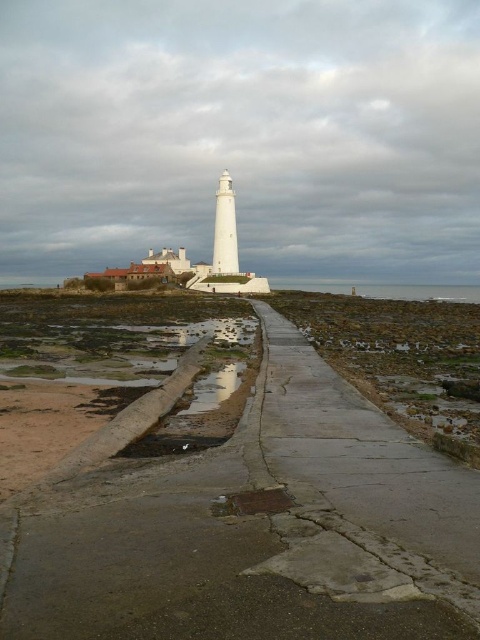
Question: Among these objects, which one is farthest from the camera?

Choices:
 (A) concrete sidewalk at center
 (B) concrete at center
 (C) glossy concrete puddle at lower center

Answer: (C)

Question: Can you confirm if concrete at center is positioned below concrete sidewalk at center?

Choices:
 (A) no
 (B) yes

Answer: (B)

Question: Which is nearer to the concrete at center?

Choices:
 (A) concrete sidewalk at center
 (B) glossy concrete puddle at lower center

Answer: (A)

Question: Where is concrete sidewalk at center located in relation to glossy concrete puddle at lower center in the image?

Choices:
 (A) right
 (B) left

Answer: (A)

Question: Can you confirm if concrete sidewalk at center is thinner than glossy concrete puddle at lower center?

Choices:
 (A) no
 (B) yes

Answer: (A)

Question: Which point is farther to the camera?

Choices:
 (A) concrete sidewalk at center
 (B) glossy concrete puddle at lower center

Answer: (B)